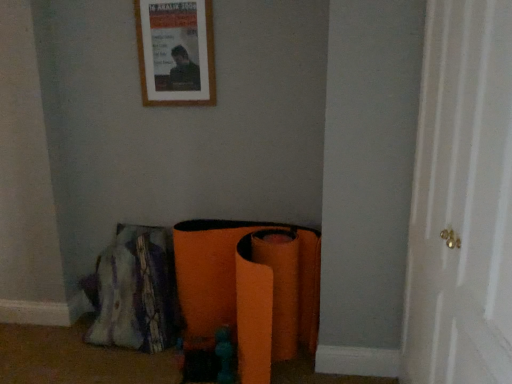
Question: Considering the positions of point (479, 193) and point (192, 36), is point (479, 193) closer or farther from the camera than point (192, 36)?

Choices:
 (A) farther
 (B) closer

Answer: (B)

Question: From the image's perspective, is white wood door at right above or below wooden picture frame at upper center?

Choices:
 (A) below
 (B) above

Answer: (A)

Question: Based on their positions, is white wood door at right located to the left or right of wooden picture frame at upper center?

Choices:
 (A) left
 (B) right

Answer: (B)

Question: In terms of size, does wooden picture frame at upper center appear bigger or smaller than white wood door at right?

Choices:
 (A) big
 (B) small

Answer: (B)

Question: Considering the positions of wooden picture frame at upper center and white wood door at right in the image, is wooden picture frame at upper center wider or thinner than white wood door at right?

Choices:
 (A) wide
 (B) thin

Answer: (B)

Question: Is wooden picture frame at upper center inside the boundaries of white wood door at right, or outside?

Choices:
 (A) inside
 (B) outside

Answer: (B)

Question: From a real-world perspective, is wooden picture frame at upper center above or below white wood door at right?

Choices:
 (A) below
 (B) above

Answer: (B)